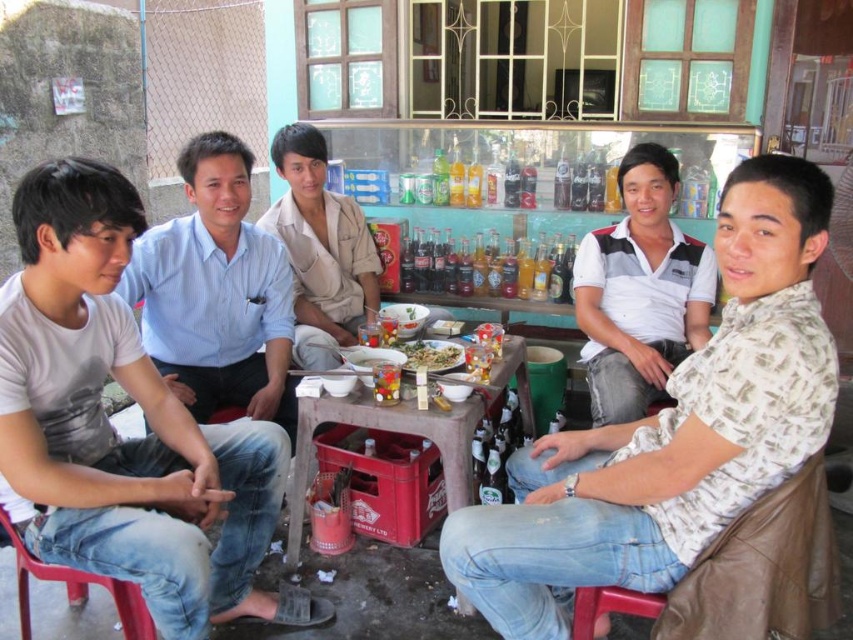
Is translucent glass bottles at center thinner than matte plastic bowls at center?

In fact, translucent glass bottles at center might be wider than matte plastic bowls at center.

Can you confirm if translucent glass bottles at center is positioned below matte plastic bowls at center?

No, translucent glass bottles at center is not below matte plastic bowls at center.

Does point (509, 285) come farther from viewer compared to point (440, 378)?

Yes, it is.

Where is `translucent glass bottles at center`? translucent glass bottles at center is located at coordinates (496, 280).

Based on the photo, between light blue shirt at center and green matte bowl at center, which one appears on the left side from the viewer's perspective?

From the viewer's perspective, light blue shirt at center appears more on the left side.

Does light blue shirt at center have a lesser width compared to green matte bowl at center?

No, light blue shirt at center is not thinner than green matte bowl at center.

This screenshot has height=640, width=853. In order to click on light blue shirt at center in this screenshot , I will do `click(216, 292)`.

Who is more distant from viewer, (257, 268) or (395, 308)?

Point (395, 308)

Is light blue shirt at center bigger than matte plastic bowls at center?

Yes, light blue shirt at center is bigger than matte plastic bowls at center.

The height and width of the screenshot is (640, 853). I want to click on light blue shirt at center, so click(216, 292).